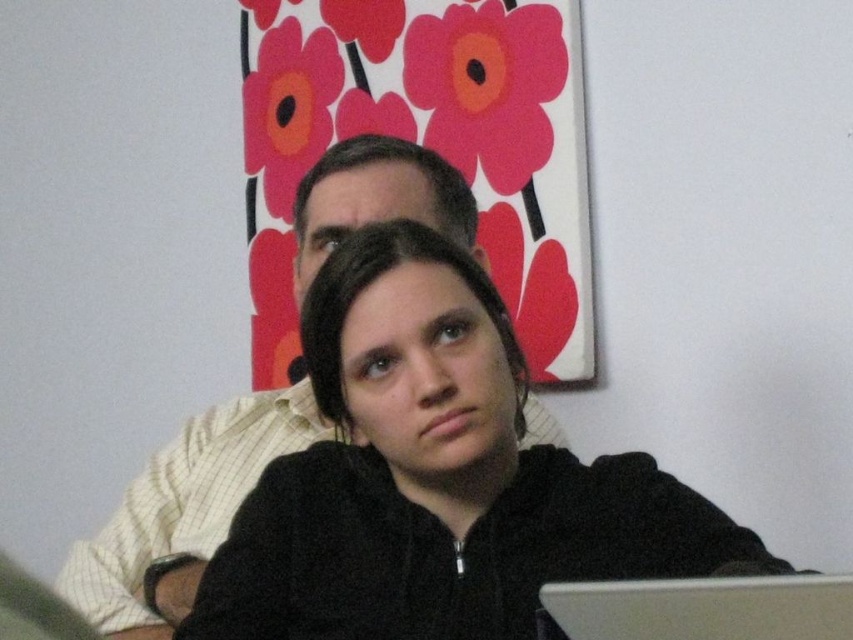
Can you confirm if black matte jacket at center is positioned below silver metallic laptop at lower center?

No.

How much distance is there between black matte jacket at center and silver metallic laptop at lower center?

A distance of 8.14 inches exists between black matte jacket at center and silver metallic laptop at lower center.

Locate an element on the screen. The height and width of the screenshot is (640, 853). black matte jacket at center is located at coordinates (437, 476).

Locate an element on the screen. The width and height of the screenshot is (853, 640). black matte jacket at center is located at coordinates (437, 476).

Who is more distant from viewer, (386, 525) or (410, 211)?

Point (410, 211)

Which of these two, black matte jacket at center or light yellow checkered shirt at center, stands shorter?

Standing shorter between the two is black matte jacket at center.

Between point (294, 554) and point (437, 176), which one is positioned behind?

Positioned behind is point (437, 176).

The width and height of the screenshot is (853, 640). I want to click on black matte jacket at center, so click(x=437, y=476).

Does light yellow checkered shirt at center appear on the right side of silver metallic laptop at lower center?

Incorrect, light yellow checkered shirt at center is not on the right side of silver metallic laptop at lower center.

Which is in front, point (532, 433) or point (614, 612)?

Point (614, 612)

Measure the distance between point (376, 196) and camera.

Point (376, 196) is 3.99 feet from camera.

Find the location of `light yellow checkered shirt at center`. light yellow checkered shirt at center is located at coordinates (183, 513).